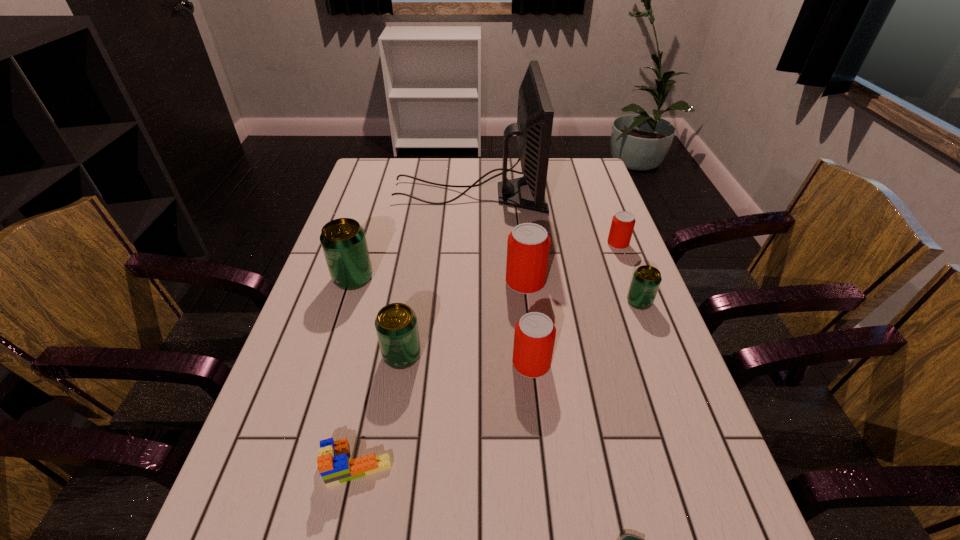
This screenshot has height=540, width=960. In order to click on object that is the fourth closest to the biggest green beer can in this screenshot , I will do `click(534, 337)`.

Find the location of a particular element. The image size is (960, 540). object identified as the fourth closest to the second farthest red beer can is located at coordinates (622, 226).

You are a GUI agent. You are given a task and a screenshot of the screen. Output one action in this format:
    pyautogui.click(x=<x>, y=<y>)
    Task: Click on the beer can that stands as the fourth closest to the eighth farthest object
    This screenshot has height=540, width=960.
    Given the screenshot: What is the action you would take?
    pyautogui.click(x=528, y=246)

Locate an element on the screen. This screenshot has width=960, height=540. beer can that is the fourth closest to the second beer can from left to right is located at coordinates (646, 280).

Locate an element on the screen. the second closest red beer can to the tallest object is located at coordinates (528, 246).

Identify which red beer can is the nearest to the smallest green beer can. Please provide its 2D coordinates. Your answer should be formatted as a tuple, i.e. [(x, y)], where the tuple contains the x and y coordinates of a point satisfying the conditions above.

[(622, 226)]

You are a GUI agent. You are given a task and a screenshot of the screen. Output one action in this format:
    pyautogui.click(x=<x>, y=<y>)
    Task: Click on the green beer can that is the closest to the tallest object
    The height and width of the screenshot is (540, 960).
    Given the screenshot: What is the action you would take?
    pyautogui.click(x=343, y=240)

Find the location of a particular element. The image size is (960, 540). green beer can that is the second nearest to the second green beer can from right to left is located at coordinates (646, 280).